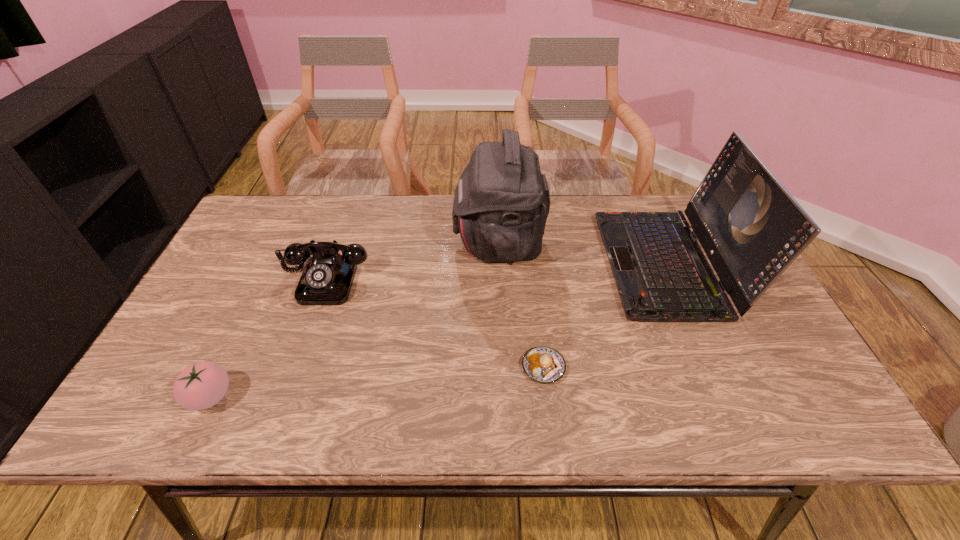
In order to click on free space between the third tallest object and the rightmost object in this screenshot , I will do coord(496,272).

I want to click on free spot between the shortest object and the shoulder bag, so click(x=521, y=304).

You are a GUI agent. You are given a task and a screenshot of the screen. Output one action in this format:
    pyautogui.click(x=<x>, y=<y>)
    Task: Click on the empty location between the rightmost object and the third tallest object
    Image resolution: width=960 pixels, height=540 pixels.
    Given the screenshot: What is the action you would take?
    pyautogui.click(x=496, y=272)

Where is `free space between the tomato and the shoulder bag`? This screenshot has height=540, width=960. free space between the tomato and the shoulder bag is located at coordinates (354, 319).

Identify the location of empty space between the third tallest object and the shoulder bag. Image resolution: width=960 pixels, height=540 pixels. (412, 260).

In order to click on the second closest object to the shoulder bag in this screenshot , I will do `click(327, 278)`.

Identify the location of object that is the fourth closest one to the third shortest object. (751, 228).

Locate an element on the screen. free point that satisfies the following two spatial constraints: 1. on the screen of the laptop computer; 2. on the front side of the pastry is located at coordinates (711, 367).

This screenshot has width=960, height=540. Find the location of `vacant area in the image that satisfies the following two spatial constraints: 1. on the open flap of the shoulder bag; 2. on the back side of the shortest object`. vacant area in the image that satisfies the following two spatial constraints: 1. on the open flap of the shoulder bag; 2. on the back side of the shortest object is located at coordinates (504, 367).

Find the location of `vacant area in the image that satisfies the following two spatial constraints: 1. on the dial of the pastry; 2. on the left side of the telephone`. vacant area in the image that satisfies the following two spatial constraints: 1. on the dial of the pastry; 2. on the left side of the telephone is located at coordinates (295, 367).